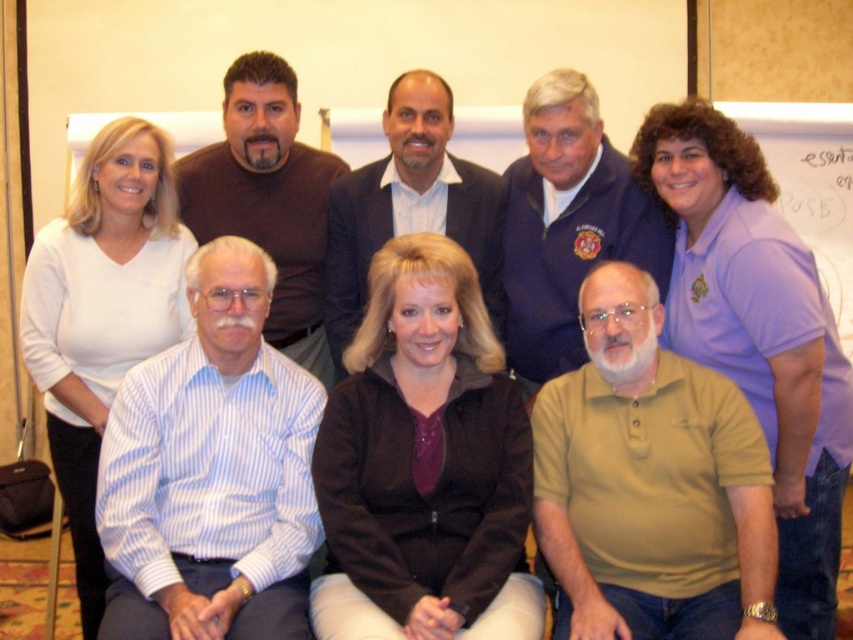
Consider the image. Can you confirm if green polo shirt at lower center is thinner than dark blue suit at center?

Yes, green polo shirt at lower center is thinner than dark blue suit at center.

Between green polo shirt at lower center and dark blue suit at center, which one is positioned higher?

dark blue suit at center is higher up.

Who is more forward, (738, 474) or (503, 205)?

Point (738, 474)

The image size is (853, 640). Identify the location of green polo shirt at lower center. (650, 483).

Does blue striped shirt at lower left have a smaller size compared to brownmaterial/textureshirt at upper center?

No.

Between point (171, 452) and point (316, 253), which one is positioned in front?

Positioned in front is point (171, 452).

What are the coordinates of `blue striped shirt at lower left` in the screenshot? It's located at (212, 472).

This screenshot has width=853, height=640. Describe the element at coordinates (212, 472) in the screenshot. I see `blue striped shirt at lower left` at that location.

Does blue striped shirt at lower left appear on the left side of white matte shirt at left?

Incorrect, blue striped shirt at lower left is not on the left side of white matte shirt at left.

Is point (292, 472) farther from camera compared to point (103, 296)?

No.

The height and width of the screenshot is (640, 853). Identify the location of blue striped shirt at lower left. (212, 472).